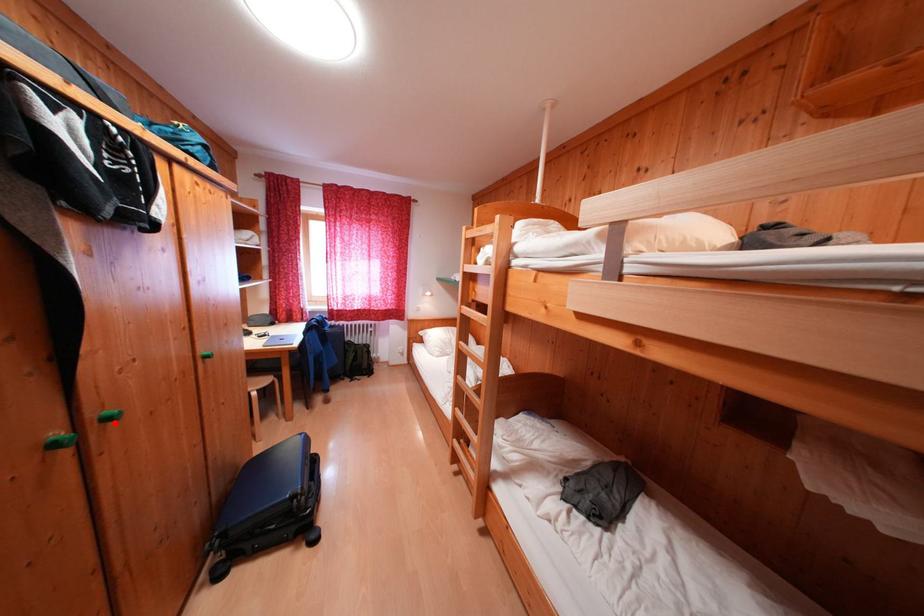
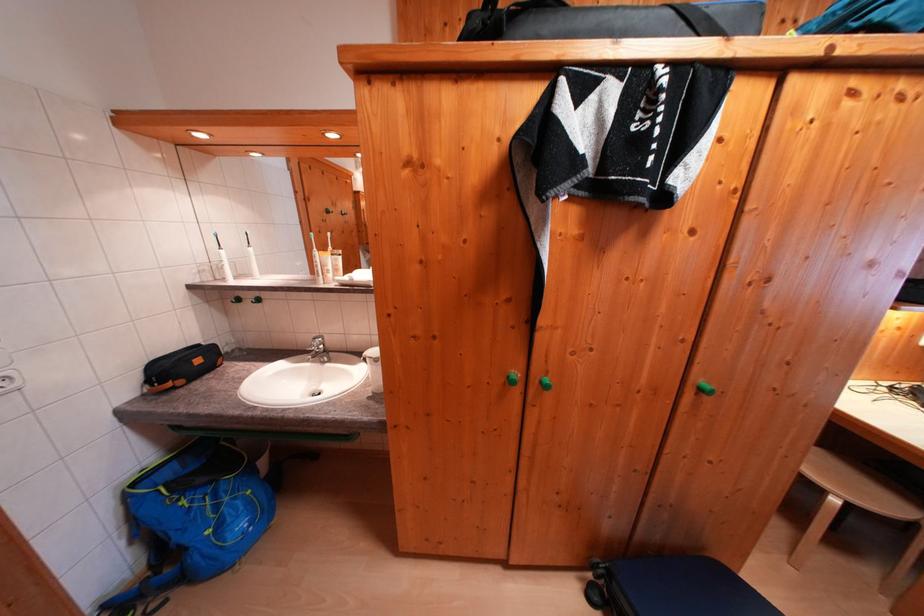
In the second image, find the point that corresponds to the highlighted location in the first image.

(550, 387)